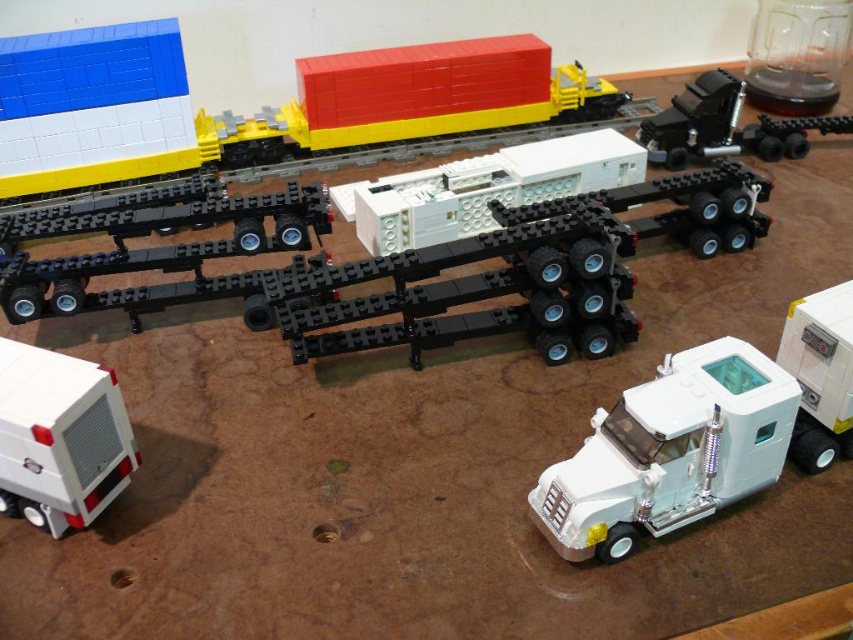
Which is more to the left, white matte truck at lower right or black rubber truck at upper right?

Positioned to the left is white matte truck at lower right.

Who is shorter, white matte truck at lower right or black rubber truck at upper right?

black rubber truck at upper right

Who is more forward, (x=833, y=404) or (x=844, y=131)?

Point (x=833, y=404)

Image resolution: width=853 pixels, height=640 pixels. I want to click on white matte truck at lower right, so click(x=820, y=374).

Does white matte trailer at center appear on the left side of white plastic trailer truck at lower right?

Indeed, white matte trailer at center is positioned on the left side of white plastic trailer truck at lower right.

Can you confirm if white matte trailer at center is wider than white plastic trailer truck at lower right?

Yes.

Is point (579, 316) more distant than point (766, 426)?

Yes, it is behind point (766, 426).

The image size is (853, 640). In order to click on white matte trailer at center in this screenshot , I will do `click(526, 269)`.

Based on the photo, between white matte trailer truck at center and black rubber truck at upper right, which one has more height?

white matte trailer truck at center is taller.

Does white matte trailer truck at center have a larger size compared to black rubber truck at upper right?

Yes.

Is point (480, 172) behind point (637, 141)?

No, (480, 172) is closer to viewer.

Where is `white matte trailer truck at center`? This screenshot has height=640, width=853. white matte trailer truck at center is located at coordinates (486, 188).